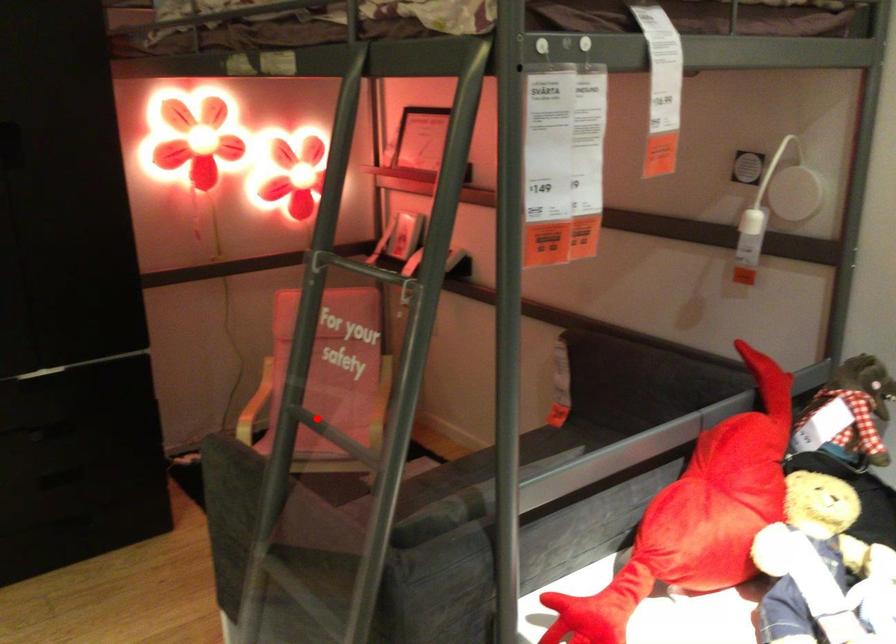
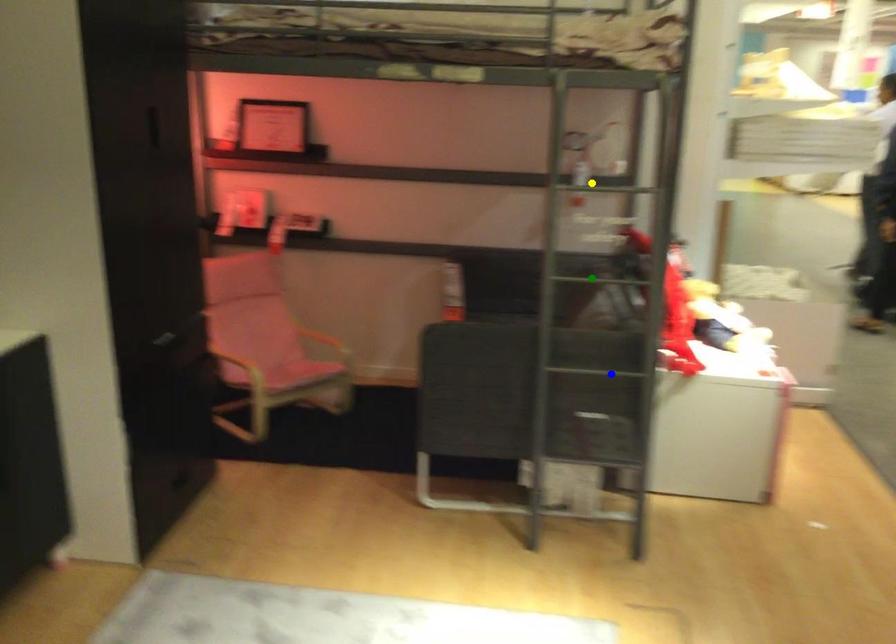
Question: I am providing you with two images of the same scene from different viewpoints. A red point is marked on the first image. You are given multiple points on the second image. Which mark in image 2 goes with the point in image 1?

Choices:
 (A) green point
 (B) blue point
 (C) yellow point

Answer: (A)